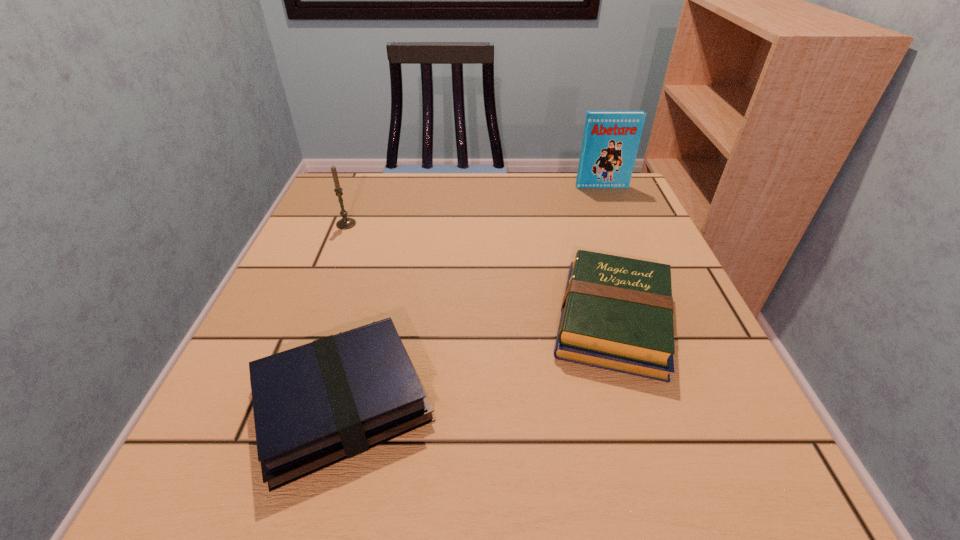
I want to click on vacant point at the far left corner, so click(x=322, y=214).

Locate an element on the screen. free location at the far right corner of the desktop is located at coordinates [581, 190].

The height and width of the screenshot is (540, 960). I want to click on free space between the farthest book and the leftmost book, so click(472, 295).

The image size is (960, 540). In order to click on vacant area that lies between the leftmost book and the candle in this screenshot , I will do `click(345, 313)`.

This screenshot has height=540, width=960. Identify the location of blank region between the leftmost book and the tallest book. (472, 295).

The width and height of the screenshot is (960, 540). In order to click on empty space between the leftmost book and the candle in this screenshot , I will do `click(345, 313)`.

Find the location of a particular element. Image resolution: width=960 pixels, height=540 pixels. empty space between the farthest book and the leftmost book is located at coordinates (472, 295).

Locate an element on the screen. The height and width of the screenshot is (540, 960). unoccupied position between the tallest book and the leftmost book is located at coordinates (472, 295).

Identify the location of free area in between the candle and the leftmost book. (345, 313).

Locate which object ranks third in proximity to the farthest object. Please provide its 2D coordinates. Your answer should be formatted as a tuple, i.e. [(x, y)], where the tuple contains the x and y coordinates of a point satisfying the conditions above.

[(317, 404)]